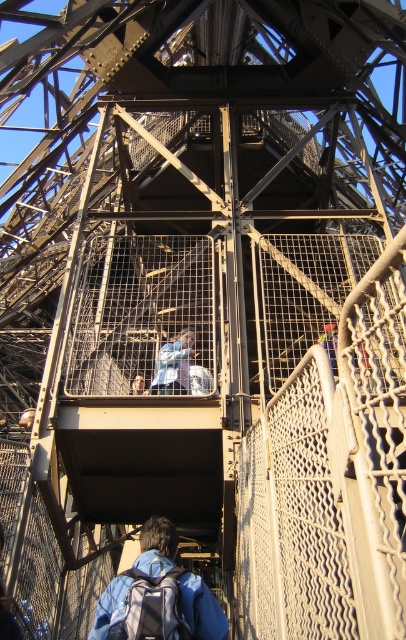
You are a tour guide at the Eiffel Tower. You notice two backpacks on a walkway. The blue fabric backpack at lower center and the matte blue backpack at lower center. Which backpack is wider?

The blue fabric backpack at lower center is wider than the matte blue backpack at lower center according to the description.

You are a tour guide explaining the Eiffel Tower to visitors. You notice a matte blue backpack at lower center and a light blue fabric at center in the image. Which object is wider?

The matte blue backpack at lower center is wider than the light blue fabric at center.